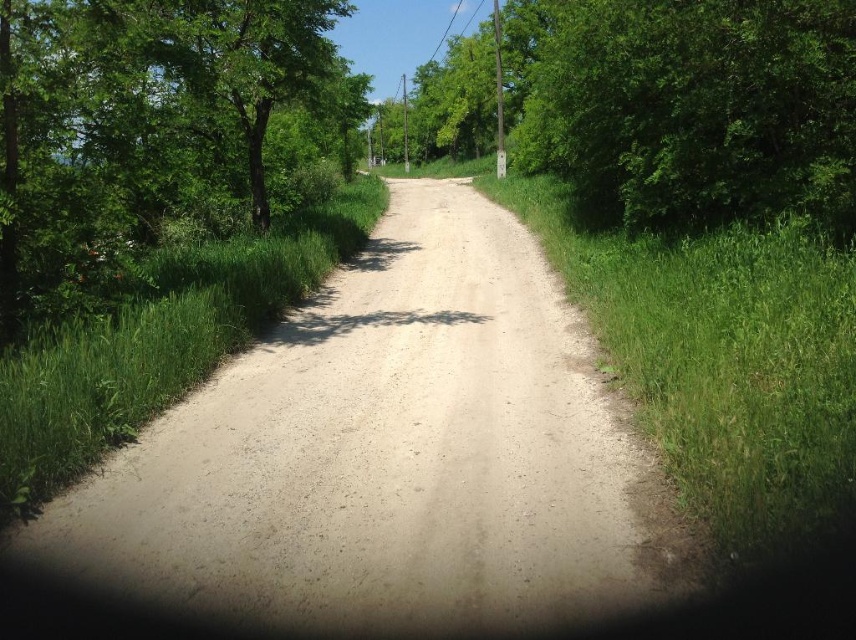
Does point (122, 268) come closer to viewer compared to point (54, 435)?

No, it is not.

Does green leafy tree at left have a lesser height compared to green grass at left?

No, green leafy tree at left is not shorter than green grass at left.

At what (x,y) coordinates should I click in order to perform the action: click on green leafy tree at left. Please return your answer as a coordinate pair (x, y). Looking at the image, I should click on (152, 129).

At what (x,y) coordinates should I click in order to perform the action: click on green leafy tree at left. Please return your answer as a coordinate pair (x, y). The height and width of the screenshot is (640, 856). Looking at the image, I should click on (152, 129).

Locate an element on the screen. dirt track at center is located at coordinates (390, 456).

Is dirt track at center to the right of green leafy tree at center from the viewer's perspective?

In fact, dirt track at center is to the left of green leafy tree at center.

Which is behind, point (179, 595) or point (819, 35)?

Positioned behind is point (819, 35).

At what (x,y) coordinates should I click in order to perform the action: click on dirt track at center. Please return your answer as a coordinate pair (x, y). This screenshot has width=856, height=640. Looking at the image, I should click on (390, 456).

How distant is green leafy tree at center from green grass at left?

green leafy tree at center is 14.57 meters from green grass at left.

What are the coordinates of `green leafy tree at center` in the screenshot? It's located at (687, 106).